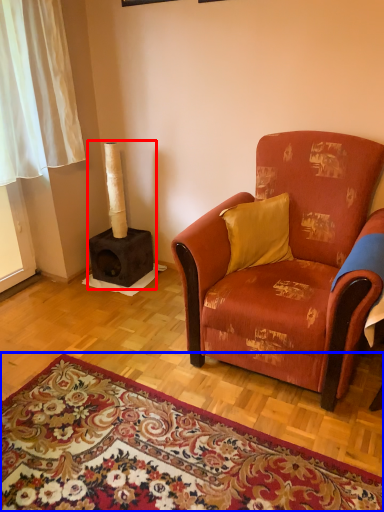
Question: Which point is further to the camera, fireplace (highlighted by a red box) or mat (highlighted by a blue box)?

Choices:
 (A) fireplace
 (B) mat

Answer: (A)